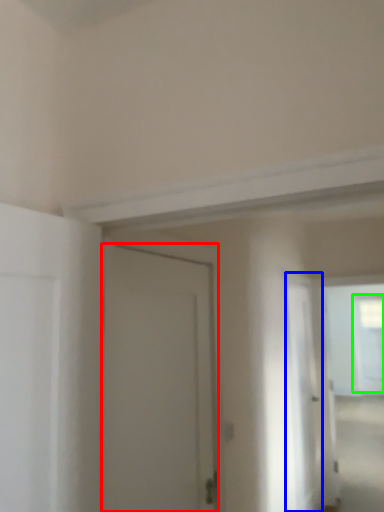
Question: Which object is the closest to the door (highlighted by a red box)? Choose among these: screen door (highlighted by a blue box) or window (highlighted by a green box).

Choices:
 (A) screen door
 (B) window

Answer: (A)